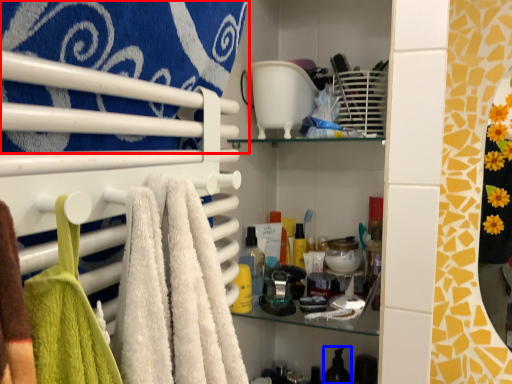
Question: Which of the following is the closest to the observer, towel (highlighted by a red box) or toiletry (highlighted by a blue box)?

Choices:
 (A) towel
 (B) toiletry

Answer: (A)